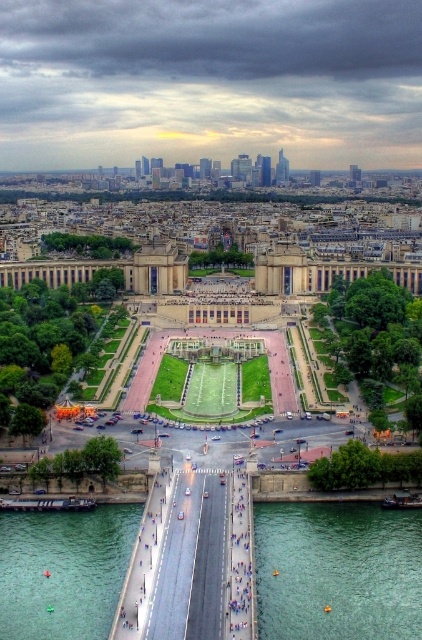
Does green water at bridge right have a lesser width compared to green water at bridge center?

In fact, green water at bridge right might be wider than green water at bridge center.

Does point (389, 577) come farther from viewer compared to point (16, 513)?

No, it is not.

Where is `green water at bridge right`? This screenshot has height=640, width=422. green water at bridge right is located at coordinates (338, 572).